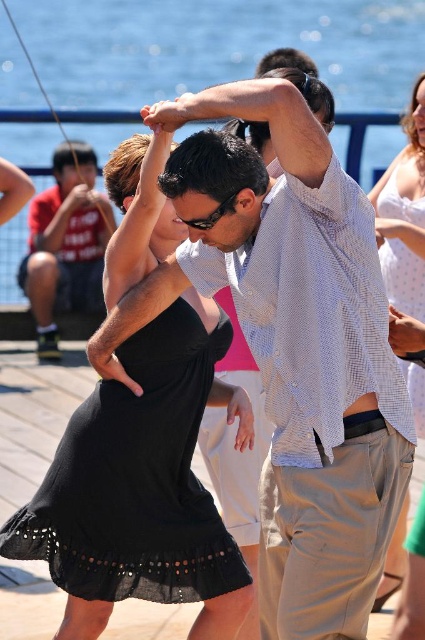
Question: Which of the following is the farthest from the observer?

Choices:
 (A) matte black shirt at left
 (B) black chiffon dress at center
 (C) black chiffon dress at right

Answer: (A)

Question: Which object appears closest to the camera in this image?

Choices:
 (A) light blue woven shirt at center
 (B) black chiffon dress at center
 (C) black chiffon dress at right

Answer: (A)

Question: Can you confirm if black chiffon dress at center is smaller than white dotted dress at upper right?

Choices:
 (A) yes
 (B) no

Answer: (B)

Question: Which point appears closest to the camera in this image?

Choices:
 (A) (61, 241)
 (B) (122, 472)
 (C) (300, 221)
 (D) (422, 225)

Answer: (C)

Question: Is light blue woven shirt at center positioned behind black chiffon dress at right?

Choices:
 (A) yes
 (B) no

Answer: (B)

Question: Can you confirm if white dotted dress at upper right is smaller than black chiffon dress at right?

Choices:
 (A) no
 (B) yes

Answer: (A)